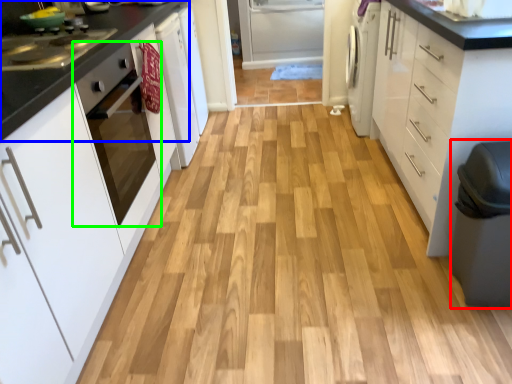
Question: Which object is the closest to the step stool (highlighted by a red box)? Choose among these: countertop (highlighted by a blue box) or home appliance (highlighted by a green box).

Choices:
 (A) countertop
 (B) home appliance

Answer: (B)